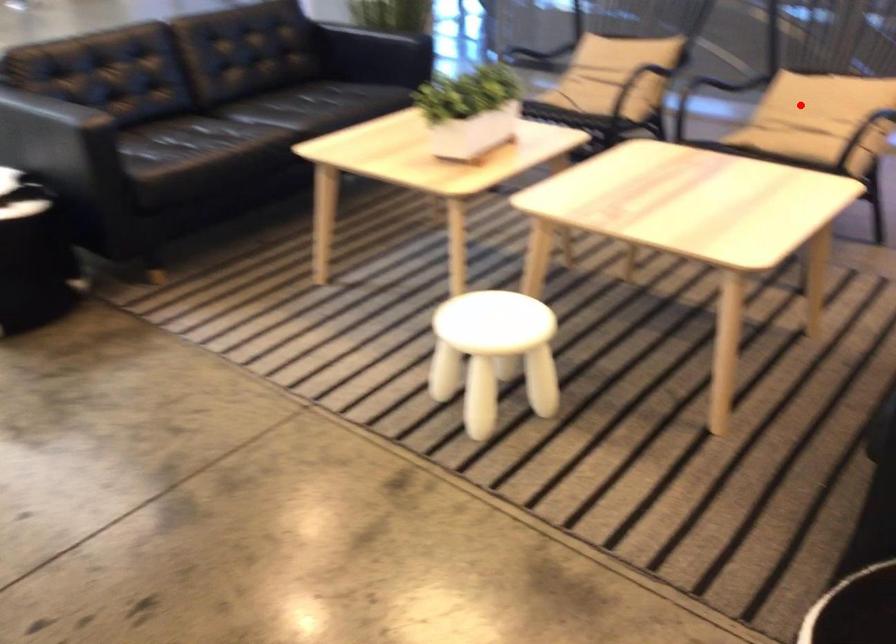
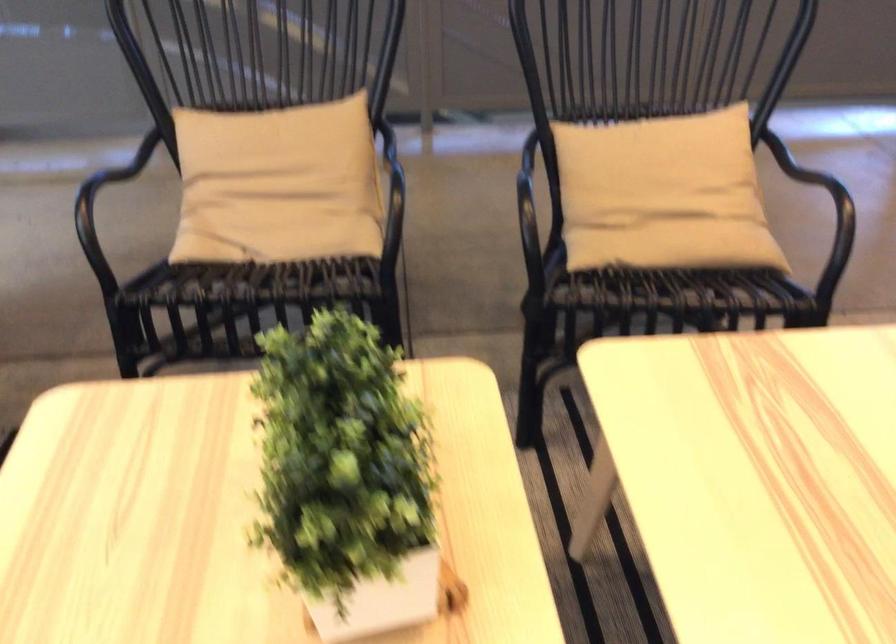
Question: I am providing you with two images of the same scene from different viewpoints. In image1, a red point is highlighted. Considering the same 3D point in image2, which of the following is correct?

Choices:
 (A) It is closer
 (B) It is farther

Answer: (A)